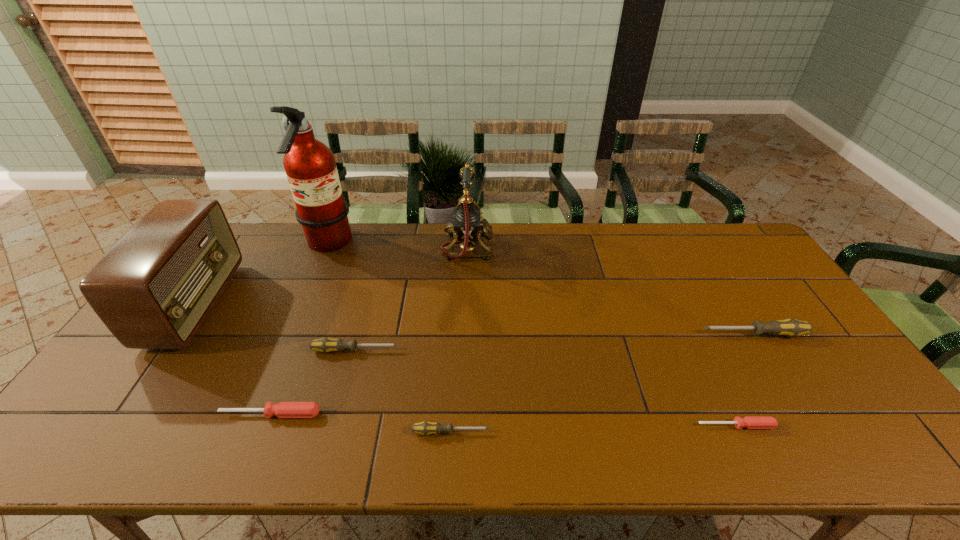
The width and height of the screenshot is (960, 540). I want to click on vacant area that satisfies the following two spatial constraints: 1. on the front-facing side of the farther red screwdriver; 2. on the right side of the leftmost object, so click(120, 414).

Where is `vacant area in the image that satisfies the following two spatial constraints: 1. on the front of the black telephone, featuring the rotary dial; 2. on the left side of the smaller red screwdriver`? The image size is (960, 540). vacant area in the image that satisfies the following two spatial constraints: 1. on the front of the black telephone, featuring the rotary dial; 2. on the left side of the smaller red screwdriver is located at coordinates (461, 426).

Locate an element on the screen. The height and width of the screenshot is (540, 960). free point that satisfies the following two spatial constraints: 1. on the front-facing side of the farther red screwdriver; 2. on the right side of the radio receiver is located at coordinates [x=120, y=414].

Identify the location of vacant space that satisfies the following two spatial constraints: 1. on the front-facing side of the radio receiver; 2. on the left side of the third nearest object. (120, 414).